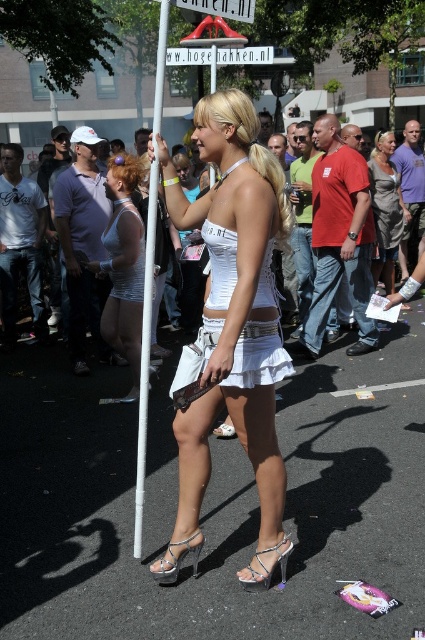
Does white fabric at lower center have a greater width compared to white matte dress at left?

Indeed, white fabric at lower center has a greater width compared to white matte dress at left.

Does white fabric at lower center lie in front of white matte dress at left?

That is True.

The width and height of the screenshot is (425, 640). Describe the element at coordinates (258, 356) in the screenshot. I see `white fabric at lower center` at that location.

You are a GUI agent. You are given a task and a screenshot of the screen. Output one action in this format:
    pyautogui.click(x=<x>, y=<y>)
    Task: Click on the white fabric at lower center
    This screenshot has width=425, height=640.
    Given the screenshot: What is the action you would take?
    pyautogui.click(x=258, y=356)

Measure the distance between silky gray dress at center and silver metallic high-heeled sandal at lower center.

silky gray dress at center is 17.52 feet from silver metallic high-heeled sandal at lower center.

Which is behind, point (385, 134) or point (164, 580)?

The point (385, 134) is behind.

Is point (376, 234) positioned behind point (170, 547)?

Yes, it is.

The width and height of the screenshot is (425, 640). In order to click on silky gray dress at center in this screenshot , I will do pos(385,209).

Between point (108, 273) and point (388, 256), which one is positioned in front?

Point (108, 273) is in front.

From the picture: How much distance is there between matte silver pole at center and silky gray dress at center?

matte silver pole at center is 11.06 feet from silky gray dress at center.

Does point (110, 195) lie in front of point (374, 204)?

Yes, point (110, 195) is closer to viewer.

Where is `matte silver pole at center`? The image size is (425, 640). matte silver pole at center is located at coordinates (124, 268).